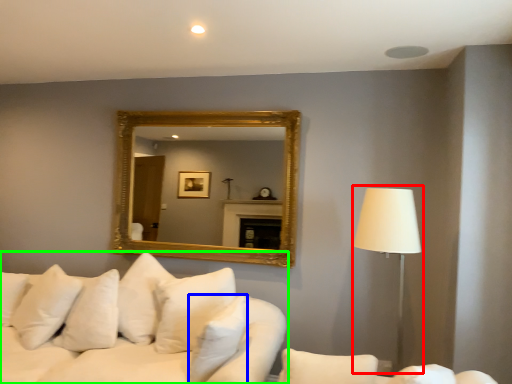
Question: Which is nearer to the table lamp (highlighted by a red box)? pillow (highlighted by a blue box) or studio couch (highlighted by a green box).

Choices:
 (A) pillow
 (B) studio couch

Answer: (A)